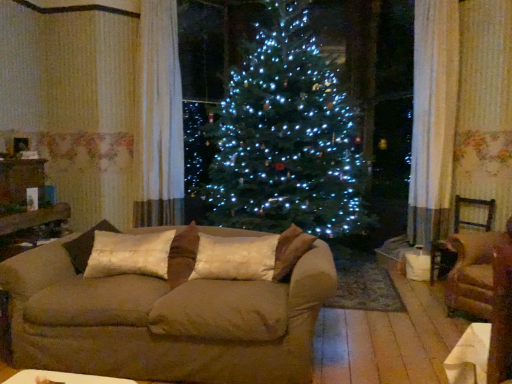
Question: In terms of width, does brown fabric armchair at right, acting as the 2th armchair starting from the front, look wider or thinner when compared to silky beige pillow at center, which is counted as the 1th pillow, starting from the right?

Choices:
 (A) thin
 (B) wide

Answer: (B)

Question: Is brown fabric armchair at right, acting as the 2th armchair starting from the front, in front of or behind silky beige pillow at center, arranged as the 2th pillow when viewed from the left, in the image?

Choices:
 (A) front
 (B) behind

Answer: (B)

Question: Considering the real-world distances, which object is farthest from the white sheer curtain at upper left?

Choices:
 (A) silky beige pillow at center, which is counted as the 1th pillow, starting from the right
 (B) brown fabric armchair at right, which is counted as the 2th armchair, starting from the back
 (C) suede couch at center
 (D) brown fabric armchair at right, which is counted as the 1th armchair, starting from the back
 (E) satin/velvet pillow at center, the first pillow positioned from the left

Answer: (D)

Question: Estimate the real-world distances between objects in this image. Which object is closer to the silky beige pillow at center, arranged as the 2th pillow when viewed from the left?

Choices:
 (A) brown fabric armchair at right, acting as the 2th armchair starting from the front
 (B) suede couch at center
 (C) white sheer curtain at upper left
 (D) brown fabric armchair at right, which is counted as the 2th armchair, starting from the back
 (E) satin/velvet pillow at center, the first pillow positioned from the left

Answer: (B)